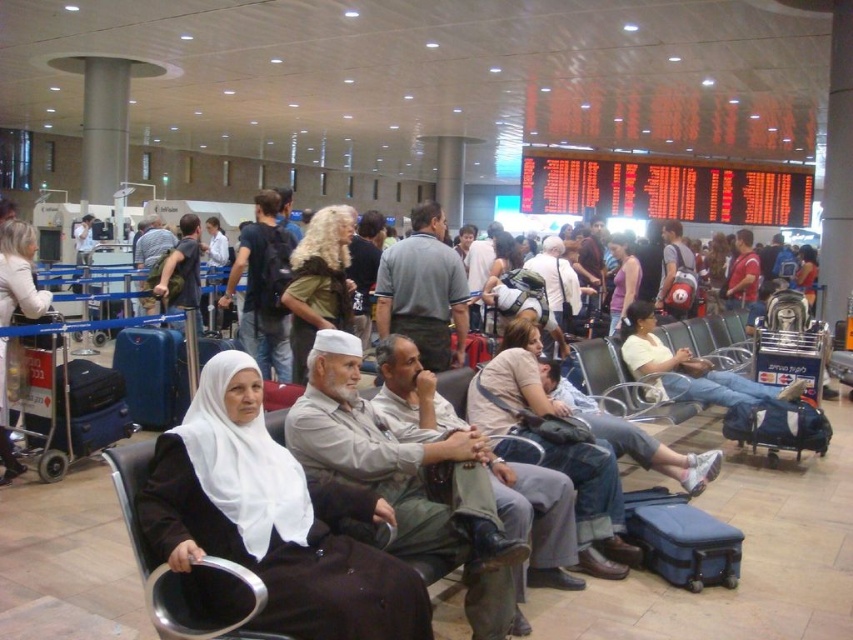
Question: Is light brown leather pants at center thinner than metallic gray chair at center?

Choices:
 (A) no
 (B) yes

Answer: (B)

Question: Which object appears closest to the camera in this image?

Choices:
 (A) dark brown leather jacket at center
 (B) purple matte shirt at center
 (C) light brown leather pants at center

Answer: (C)

Question: Does light brown leather pants at center come behind purple matte shirt at center?

Choices:
 (A) yes
 (B) no

Answer: (B)

Question: Which of these objects is positioned closest to the blue hardshell suitcase at lower right?

Choices:
 (A) dark brown leather jacket at center
 (B) white fabric headscarf at left

Answer: (A)

Question: Considering the real-world distances, which object is closest to the light brown leather jacket at center?

Choices:
 (A) purple matte shirt at center
 (B) black fabric headscarf at center
 (C) black plastic chair at center
 (D) metallic silver chair at center

Answer: (D)

Question: Is dark brown leather jacket at center above matte blue suitcase at center?

Choices:
 (A) no
 (B) yes

Answer: (B)